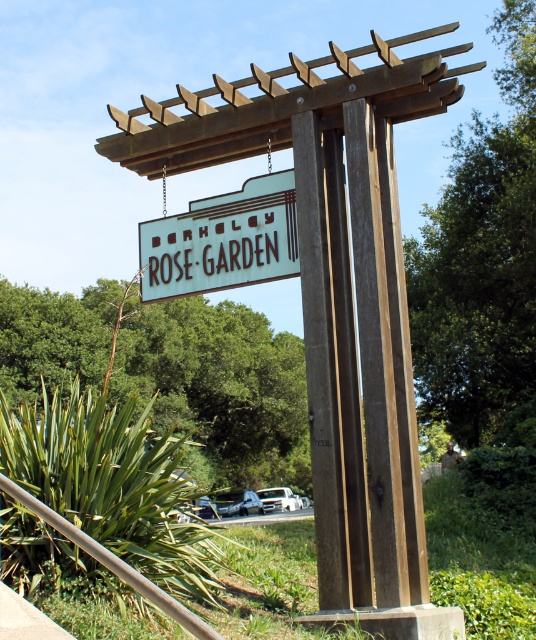
You are planning to install a new decorative light fixture between the brown wooden pergola at center and the white wood sign at center. Since you want the light to be equidistant from both, can you determine which object you should place the light closer to?

The brown wooden pergola at center is wider than the white wood sign at center. To place the light equidistant from both, you should position it closer to the white wood sign at center because the pergola is wider and occupies more space.

You are standing in front of the BERKELEY ROSE GARDEN sign and want to take a photo of the brown wooden pergola at center. If your camera has a maximum focus range of 25 feet, will you need to move closer to get a clear shot?

The brown wooden pergola at center is 27.46 feet away from the viewer. Since this distance exceeds the camera maximum focus range of 25 feet, you need to move closer to ensure the camera can focus properly.

You are planning to place a new decorative pot that is 24 inches wide between the brown wooden pergola at center and the white wood sign at center. Will there be enough space for the pot to fit between them?

The brown wooden pergola at center and white wood sign at center are 25.90 inches apart. Since the decorative pot is 24 inches wide, there is enough space between them for the pot to fit.